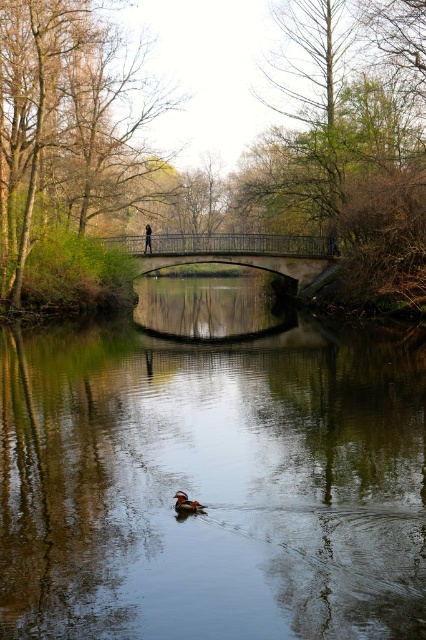
Question: Which object is farther from the camera taking this photo?

Choices:
 (A) stone bridge at center
 (B) smooth reflective water at center
 (C) green leafy tree at upper center

Answer: (A)

Question: Is orange-brown wood duck at center to the left of dark blue jeans at center from the viewer's perspective?

Choices:
 (A) no
 (B) yes

Answer: (A)

Question: Is green leafy tree at upper left below stone bridge at center?

Choices:
 (A) yes
 (B) no

Answer: (B)

Question: Estimate the real-world distances between objects in this image. Which object is closer to the dark blue jeans at center?

Choices:
 (A) smooth reflective water at center
 (B) green leafy tree at upper center
 (C) green leafy tree at upper left
 (D) stone bridge at center

Answer: (D)

Question: Is smooth reflective water at center below green leafy tree at upper left?

Choices:
 (A) no
 (B) yes

Answer: (B)

Question: Among these objects, which one is nearest to the camera?

Choices:
 (A) dark blue jeans at center
 (B) smooth reflective water at center
 (C) green leafy tree at upper center

Answer: (B)